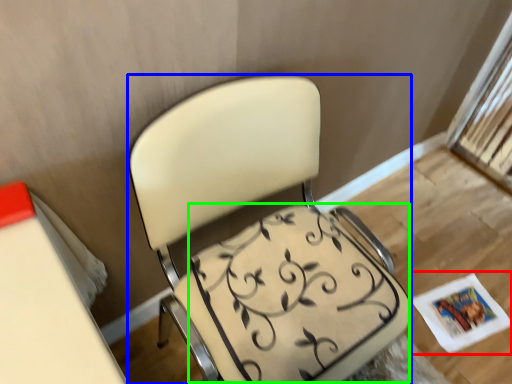
Question: Which is nearer to the magazine (highlighted by a red box)? chair (highlighted by a blue box) or swivel chair (highlighted by a green box).

Choices:
 (A) chair
 (B) swivel chair

Answer: (B)